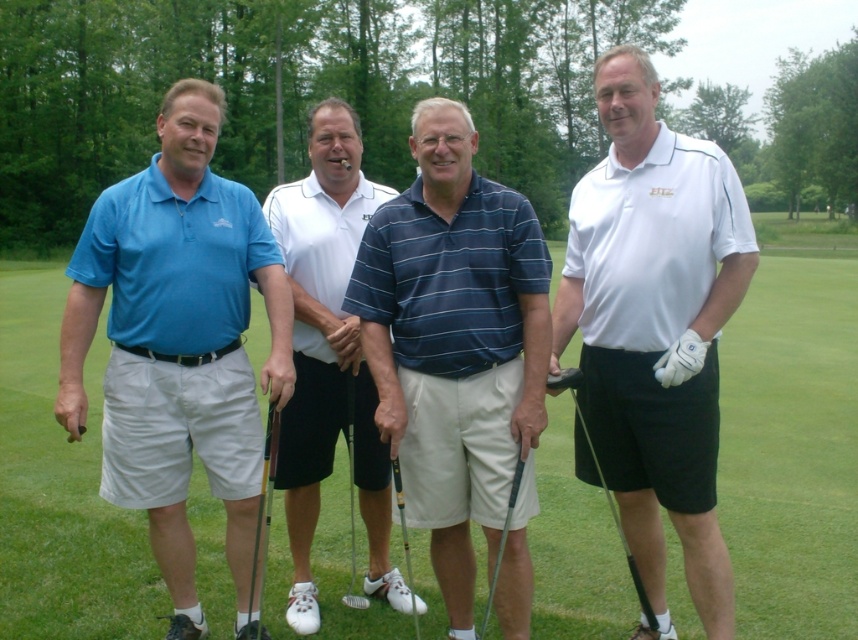
You are a golfer who wants to place your white matte golf club at center on the green grass at center. Can you fit the entire club on the grass area?

The green grass at center is larger in size than the white matte golf club at center, so yes, the entire club can fit on the grass area.

You are a golfer standing on the green grass at center, holding the white matte golf club at center. You want to hit a ball to a hole that is 12 meters away from your current position. Can you reach the hole in one shot if you use this golf club?

The green grass at center is 10.96 meters from the white matte golf club at center. Since the hole is 12 meters away from your position on the green grass at center, you would need a slightly longer shot than the distance between the grass and the club. However, golf clubs can vary in their driving distances, so it depends on the specific club used. If the white matte golf club at center is capable of hitting the ball at least 12 meters, then yes, you can reach the hole in one shot. Otherwise, you might not